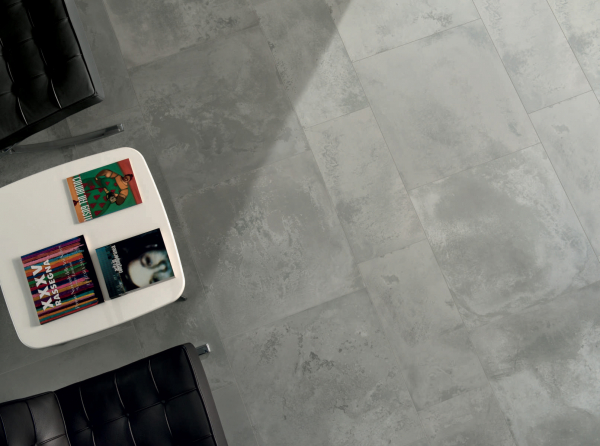
The width and height of the screenshot is (600, 446). In order to click on book/magazines in this screenshot , I will do `click(68, 288)`, `click(141, 274)`, `click(111, 191)`.